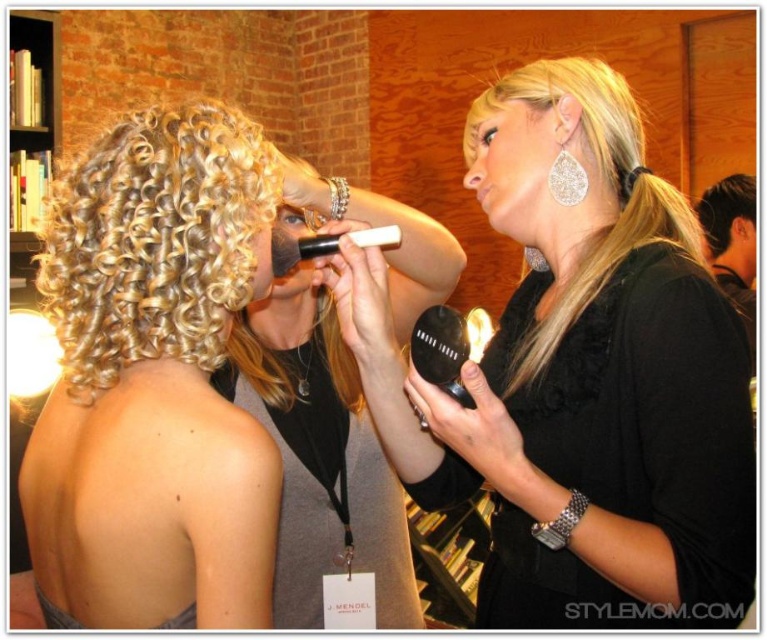
Question: Which point is closer to the camera?

Choices:
 (A) (170, 378)
 (B) (700, 221)
 (C) (736, 227)

Answer: (A)

Question: Considering the real-world distances, which object is farthest from the matte black brush at upper center?

Choices:
 (A) blonde shiny hair at upper center
 (B) dark brown hair at upper right
 (C) satin black compact at center

Answer: (B)

Question: Can you confirm if satin silver earrings at upper right is positioned below matte black makeup brush at center?

Choices:
 (A) no
 (B) yes

Answer: (A)

Question: Which object appears farthest from the camera in this image?

Choices:
 (A) matte black mascara at center
 (B) satin black dress at upper right

Answer: (B)

Question: Considering the relative positions of satin silver earrings at upper right and matte black makeup brush at center in the image provided, where is satin silver earrings at upper right located with respect to matte black makeup brush at center?

Choices:
 (A) above
 (B) below

Answer: (A)

Question: Does satin black compact at center appear over matte black mascara at center?

Choices:
 (A) yes
 (B) no

Answer: (B)